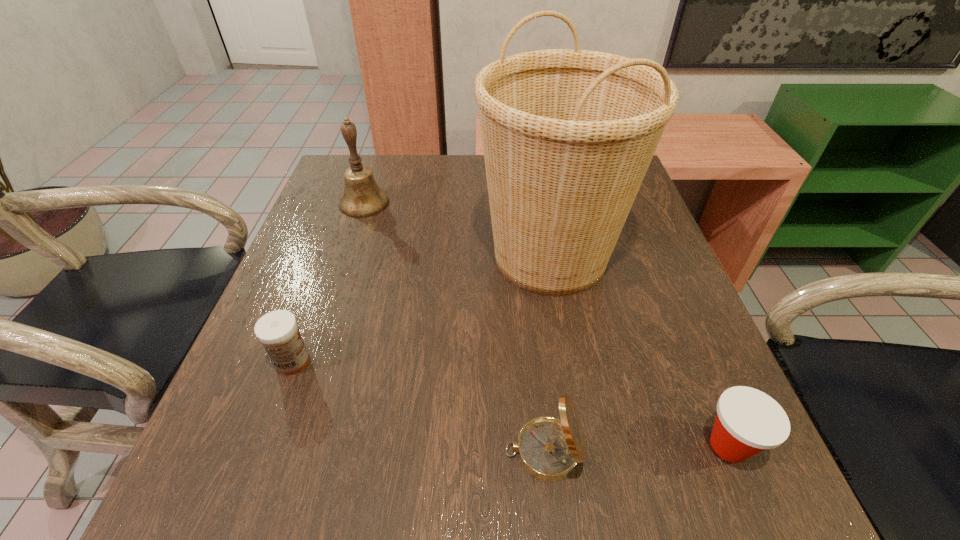
I want to click on object situated at the near right corner, so click(x=748, y=421).

Where is `vacant space at the far edge`? The height and width of the screenshot is (540, 960). vacant space at the far edge is located at coordinates (472, 173).

In the image, there is a desktop. At what (x,y) coordinates should I click in order to perform the action: click on free space at the left edge. Please return your answer as a coordinate pair (x, y). Looking at the image, I should click on (322, 218).

In the image, there is a desktop. Find the location of `free space at the right edge`. free space at the right edge is located at coordinates (646, 237).

In the image, there is a desktop. Find the location of `free space at the near left corner`. free space at the near left corner is located at coordinates (189, 481).

I want to click on blank space at the near right corner of the desktop, so click(749, 465).

You are a GUI agent. You are given a task and a screenshot of the screen. Output one action in this format:
    pyautogui.click(x=<x>, y=<y>)
    Task: Click on the free space between the rightmost object and the medicine
    This screenshot has width=960, height=540.
    Given the screenshot: What is the action you would take?
    pyautogui.click(x=511, y=403)

Where is `vacant area that lies between the basket and the compass`? This screenshot has width=960, height=540. vacant area that lies between the basket and the compass is located at coordinates (547, 354).

In order to click on vacant area that lies between the bell and the rightmost object in this screenshot , I will do `click(546, 324)`.

Locate an element on the screen. unoccupied position between the tallest object and the compass is located at coordinates (547, 354).